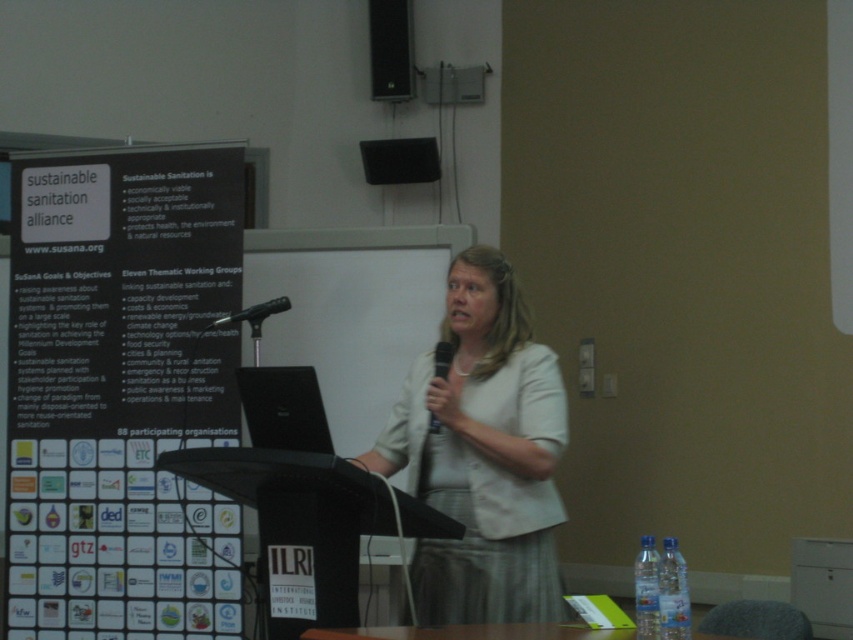
Question: Can you confirm if matte black speaker at upper center is positioned above black matte microphone at center?

Choices:
 (A) no
 (B) yes

Answer: (B)

Question: Which of the following is the closest to the observer?

Choices:
 (A) black plastic microphone at center
 (B) black matte microphone at center
 (C) white paper at left

Answer: (A)

Question: Considering the real-world distances, which object is farthest from the black plastic microphone at center?

Choices:
 (A) matte black speaker at upper center
 (B) white paper at left
 (C) black matte microphone at center

Answer: (A)

Question: Which of the following is the farthest from the observer?

Choices:
 (A) white fabric at center
 (B) black plastic microphone at center

Answer: (B)

Question: Does white fabric at center appear on the right side of black matte microphone at center?

Choices:
 (A) no
 (B) yes

Answer: (B)

Question: Can you confirm if white fabric at center is positioned to the left of black matte microphone at center?

Choices:
 (A) no
 (B) yes

Answer: (A)